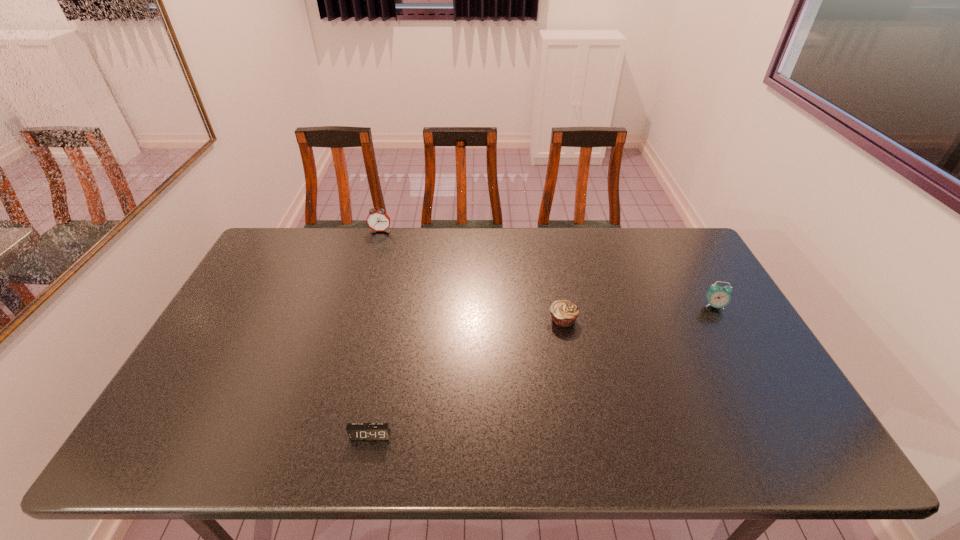
At what (x,y) coordinates should I click in order to perform the action: click on free spot between the second alarm clock from left to right and the third object from left to right. Please return your answer as a coordinate pair (x, y). The width and height of the screenshot is (960, 540). Looking at the image, I should click on (467, 377).

Where is `object identified as the second closest to the farthest object`? This screenshot has width=960, height=540. object identified as the second closest to the farthest object is located at coordinates (356, 431).

Identify the location of object that stands as the third closest to the leftmost alarm clock. The image size is (960, 540). (x=718, y=297).

This screenshot has width=960, height=540. I want to click on alarm clock that can be found as the closest to the leftmost object, so coord(356,431).

Where is `alarm clock that stands as the closest to the third tallest object`? alarm clock that stands as the closest to the third tallest object is located at coordinates (718, 297).

At what (x,y) coordinates should I click in order to perform the action: click on free spot that satisfies the following two spatial constraints: 1. on the clock face of the muffin; 2. on the left side of the farthest alarm clock. Please return your answer as a coordinate pair (x, y). The height and width of the screenshot is (540, 960). Looking at the image, I should click on (354, 320).

The image size is (960, 540). Find the location of `free space that satisfies the following two spatial constraints: 1. on the clock face of the leftmost object; 2. on the right side of the third tallest object`. free space that satisfies the following two spatial constraints: 1. on the clock face of the leftmost object; 2. on the right side of the third tallest object is located at coordinates [x=354, y=320].